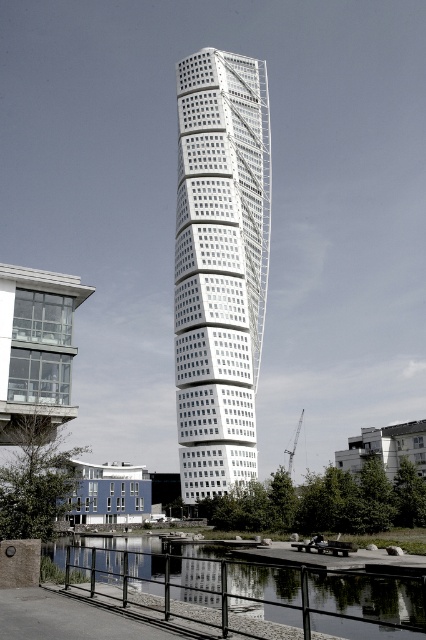
You are a drone operator tasked with flying a drone from the clear glass building at left to the white concrete building at lower right. The drone has a maximum flight range of 150 feet. Based on the scene, can the drone successfully complete the journey without needing to recharge?

The distance between the clear glass building at left and the white concrete building at lower right is 137.75 feet, which is within the drone operator drone has a maximum flight range of 150 feet. Therefore, the drone can successfully complete the journey without needing to recharge.

You are standing at the center of the image and want to locate the blue painted concrete building at lower left. According to the coordinates provided, in which direction should you look to find it?

The blue painted concrete building at lower left is located at coordinates point (109, 493). Since you are at the center, you should look to the left and downward to find it.